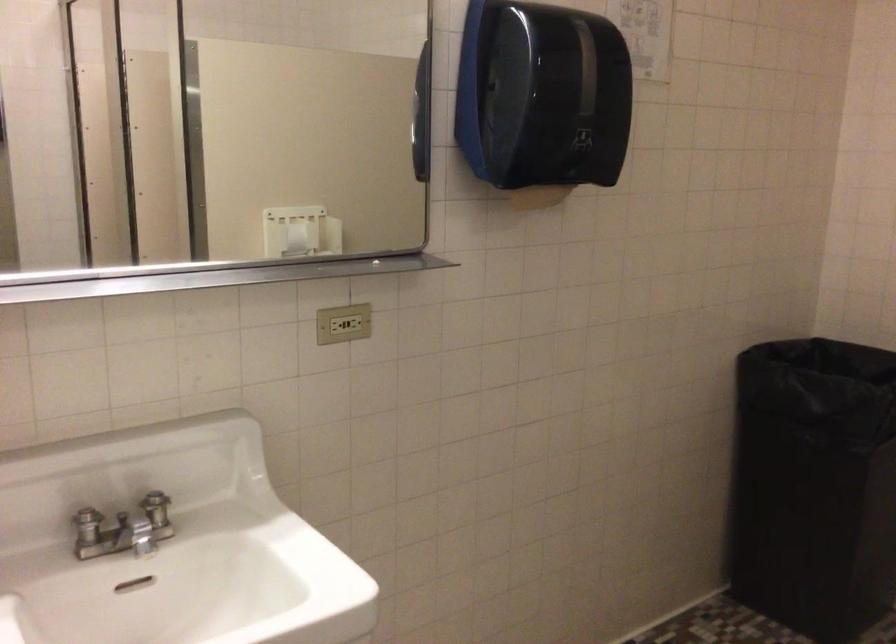
The image size is (896, 644). I want to click on chrome faucet handle, so click(118, 534).